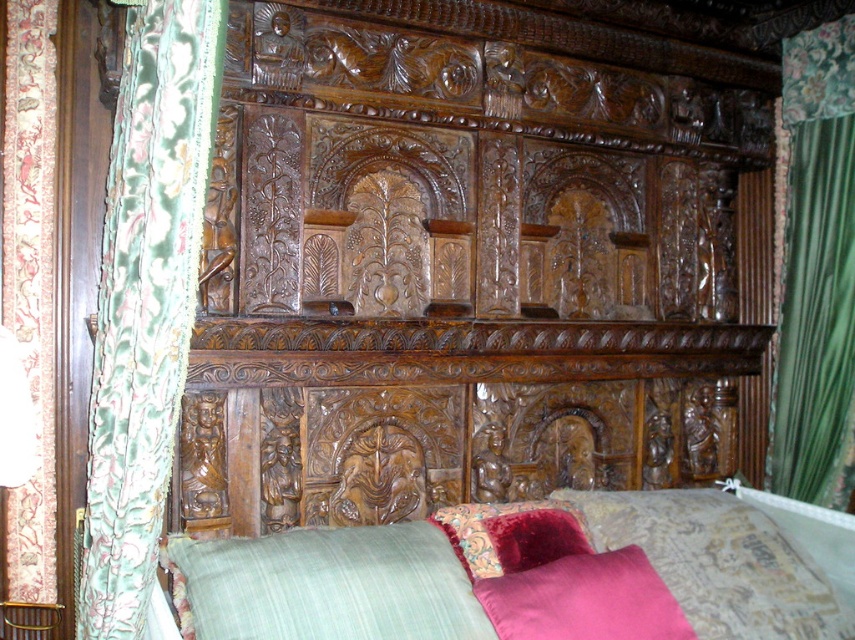
Who is more forward, (x=174, y=172) or (x=24, y=48)?

Point (x=174, y=172) is more forward.

Is point (133, 538) farther from viewer compared to point (50, 502)?

No, (133, 538) is in front of (50, 502).

Does point (145, 604) lie in front of point (4, 112)?

Yes, point (145, 604) is in front of point (4, 112).

In order to click on green satin curtain at left in this screenshot , I will do `click(145, 300)`.

Does green fabric pillow at lower center appear over velvet pink pillow at lower right?

Yes, green fabric pillow at lower center is above velvet pink pillow at lower right.

Consider the image. Is green fabric pillow at lower center closer to the viewer compared to velvet pink pillow at lower right?

Yes, it is in front of velvet pink pillow at lower right.

Between point (273, 611) and point (705, 632), which one is positioned behind?

Point (705, 632)

Where is `green fabric pillow at lower center`? This screenshot has height=640, width=855. green fabric pillow at lower center is located at coordinates (331, 586).

Is green fabric pillow at lower center above velvet fabric curtain at left?

Actually, green fabric pillow at lower center is below velvet fabric curtain at left.

Is point (220, 554) closer to viewer compared to point (9, 17)?

Yes, it is in front of point (9, 17).

In order to click on green fabric pillow at lower center in this screenshot , I will do `click(331, 586)`.